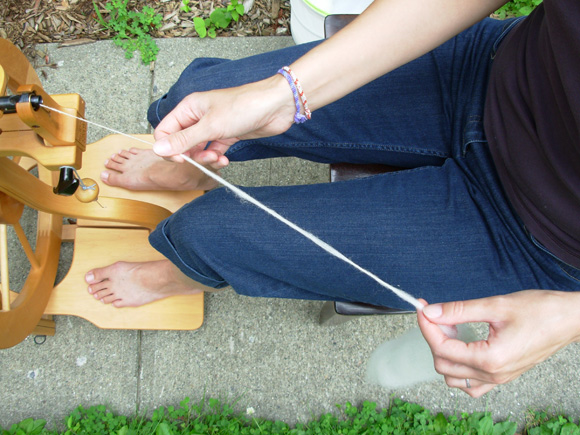
At what (x,y) coordinates should I click in order to perform the action: click on front left silver chair leg. Please return your answer as a coordinate pair (x, y). The image size is (580, 435). Looking at the image, I should click on (338, 317).